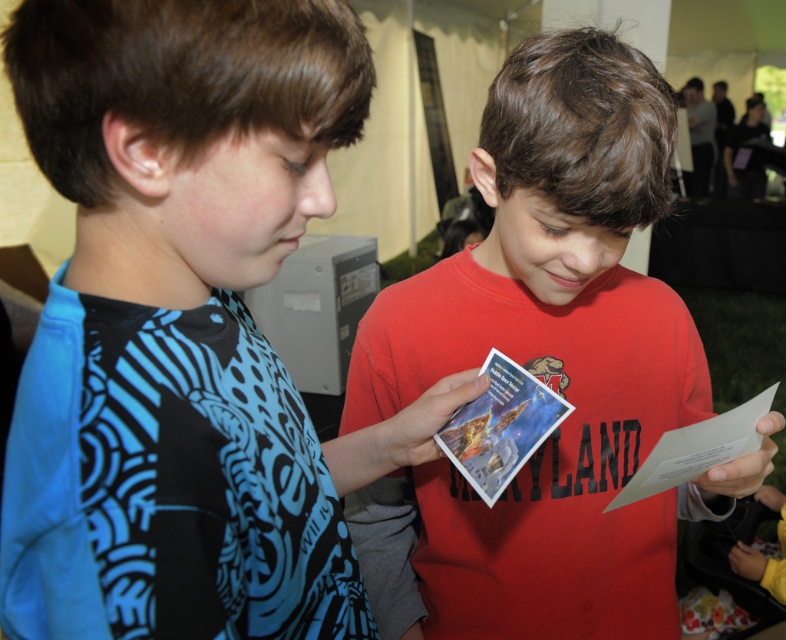
Does metallic glossy card at center have a lesser height compared to white paper at center?

No, metallic glossy card at center is not shorter than white paper at center.

Does metallic glossy card at center have a larger size compared to white paper at center?

Yes.

Looking at this image, who is more forward, (487, 372) or (687, 458)?

Point (687, 458) is in front.

This screenshot has height=640, width=786. I want to click on metallic glossy card at center, so click(x=501, y=426).

Is red matte shirt at center smaller than white paper at center?

No.

Identify the location of red matte shirt at center. The width and height of the screenshot is (786, 640). (551, 355).

What are the coordinates of `red matte shirt at center` in the screenshot? It's located at [551, 355].

At what (x,y) coordinates should I click in order to perform the action: click on red matte shirt at center. Please return your answer as a coordinate pair (x, y). Looking at the image, I should click on (551, 355).

Does blue printed shirt at left have a larger size compared to white paper at center?

Yes, blue printed shirt at left is bigger than white paper at center.

I want to click on blue printed shirt at left, so click(189, 323).